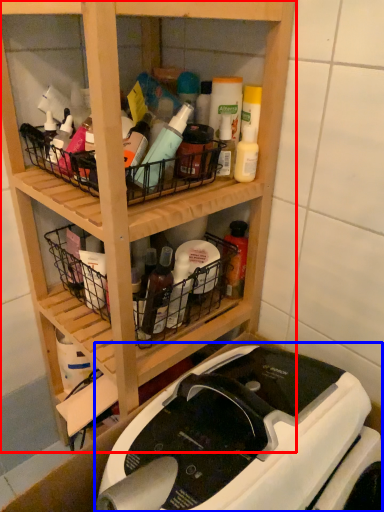
Question: Which object is closer to the camera taking this photo, shelf (highlighted by a red box) or sewing machine (highlighted by a blue box)?

Choices:
 (A) shelf
 (B) sewing machine

Answer: (B)